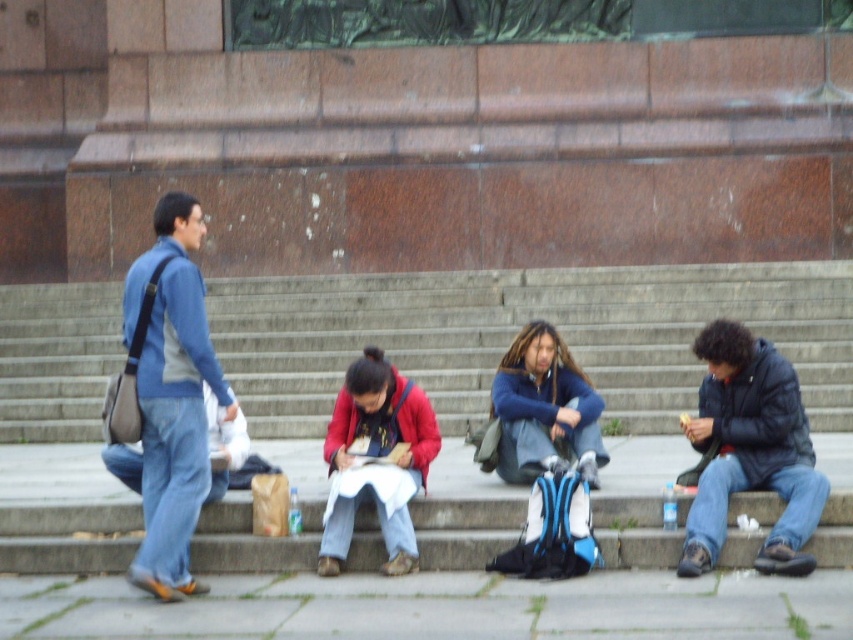
Question: From the image, what is the correct spatial relationship of blue denim jeans at left in relation to matte red jacket at center?

Choices:
 (A) left
 (B) right

Answer: (A)

Question: Is the position of blue denim jeans at left less distant than that of matte red jacket at center?

Choices:
 (A) no
 (B) yes

Answer: (B)

Question: Which object is the farthest from the matte red jacket at center?

Choices:
 (A) blue denim jeans at left
 (B) dark blue jacket at lower right
 (C) matte blue jacket at center

Answer: (B)

Question: Considering the real-world distances, which object is closest to the dark blue jacket at lower right?

Choices:
 (A) gray concrete stairs at center
 (B) matte red jacket at center
 (C) blue denim jeans at left

Answer: (B)

Question: Can you confirm if matte red jacket at center is wider than matte blue jacket at center?

Choices:
 (A) no
 (B) yes

Answer: (A)

Question: Considering the real-world distances, which object is farthest from the gray concrete stairs at center?

Choices:
 (A) matte blue jacket at center
 (B) blue denim jeans at left
 (C) matte red jacket at center
 (D) dark blue jacket at lower right

Answer: (B)